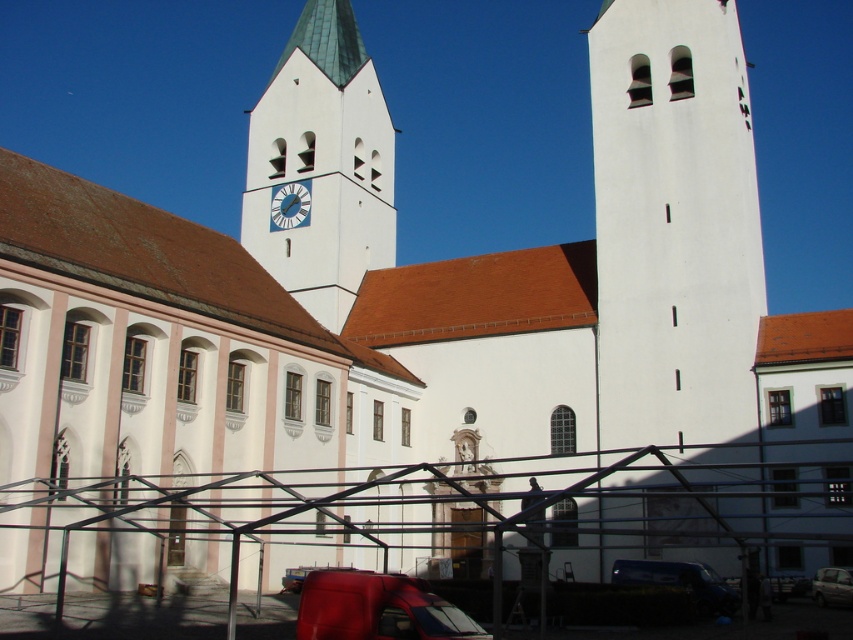
What do you see at coordinates (672, 225) in the screenshot?
I see `white smooth tower at center` at bounding box center [672, 225].

Is white smooth tower at center below matte red van at lower center?

No.

Is point (682, 125) positioned before point (314, 580)?

No, it is not.

This screenshot has width=853, height=640. I want to click on white smooth tower at center, so click(672, 225).

Which is in front, point (631, 566) or point (294, 186)?

Positioned in front is point (631, 566).

Does dark blue metallic van at lower right have a greater width compared to metallic clock face at center?

Indeed, dark blue metallic van at lower right has a greater width compared to metallic clock face at center.

Does point (691, 568) lie in front of point (300, 186)?

Yes.

Where is `dark blue metallic van at lower right`? This screenshot has width=853, height=640. dark blue metallic van at lower right is located at coordinates (680, 580).

Does white smooth tower at center have a greater height compared to metallic clock face at center?

Yes, white smooth tower at center is taller than metallic clock face at center.

Image resolution: width=853 pixels, height=640 pixels. Find the location of `white smooth tower at center`. white smooth tower at center is located at coordinates (672, 225).

Where is `white smooth tower at center`? The image size is (853, 640). white smooth tower at center is located at coordinates (672, 225).